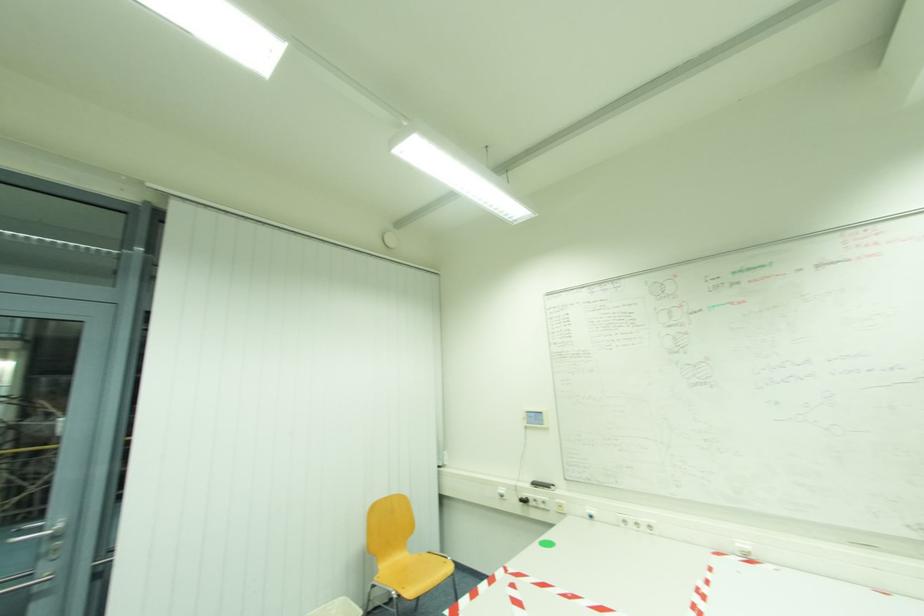
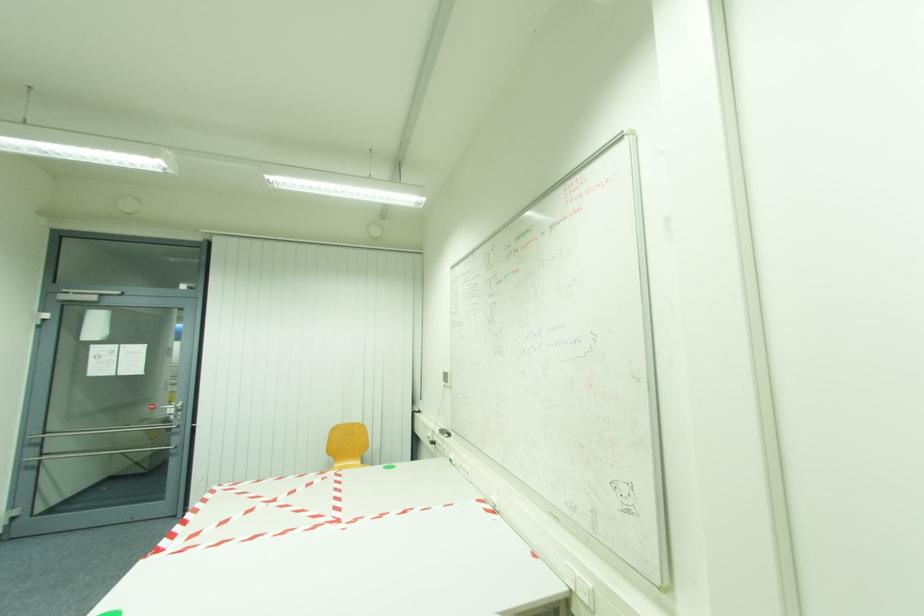
Question: The images are taken continuously from a first-person perspective. In which direction are you moving?

Choices:
 (A) Left
 (B) Right
 (C) Forward
 (D) Backward

Answer: (B)